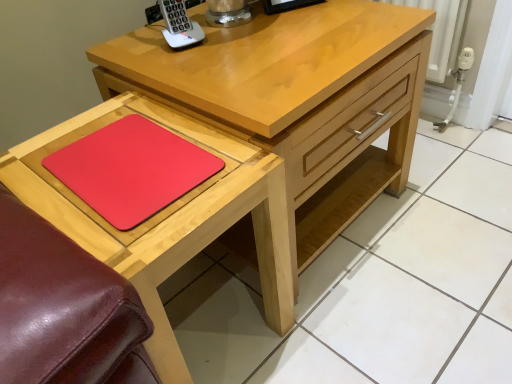
Question: Is matte wooden table at lower left outside of white plastic phone at upper center?

Choices:
 (A) yes
 (B) no

Answer: (A)

Question: Can you confirm if matte wooden table at lower left is positioned to the right of white plastic phone at upper center?

Choices:
 (A) yes
 (B) no

Answer: (B)

Question: Is matte wooden table at lower left not near white plastic phone at upper center?

Choices:
 (A) no
 (B) yes

Answer: (A)

Question: Does matte wooden table at lower left come in front of white plastic phone at upper center?

Choices:
 (A) yes
 (B) no

Answer: (A)

Question: Can you confirm if matte wooden table at lower left is thinner than white plastic phone at upper center?

Choices:
 (A) yes
 (B) no

Answer: (B)

Question: Is white plastic phone at upper center bigger or smaller than rubberized red mousepad at lower left?

Choices:
 (A) big
 (B) small

Answer: (B)

Question: From the image's perspective, relative to rubberized red mousepad at lower left, is white plastic phone at upper center above or below?

Choices:
 (A) above
 (B) below

Answer: (A)

Question: Which is correct: white plastic phone at upper center is inside rubberized red mousepad at lower left, or outside of it?

Choices:
 (A) inside
 (B) outside

Answer: (B)

Question: Is point (189, 44) closer or farther from the camera than point (119, 188)?

Choices:
 (A) farther
 (B) closer

Answer: (A)

Question: Is matte wooden table at lower left wider or thinner than matte wood chest of drawers at center?

Choices:
 (A) wide
 (B) thin

Answer: (B)

Question: Would you say matte wooden table at lower left is to the left or to the right of matte wood chest of drawers at center in the picture?

Choices:
 (A) left
 (B) right

Answer: (A)

Question: From their relative heights in the image, would you say matte wooden table at lower left is taller or shorter than matte wood chest of drawers at center?

Choices:
 (A) short
 (B) tall

Answer: (A)

Question: Is point (104, 122) closer or farther from the camera than point (286, 91)?

Choices:
 (A) closer
 (B) farther

Answer: (B)

Question: From a real-world perspective, is rubberized red mousepad at lower left positioned above or below matte wood chest of drawers at center?

Choices:
 (A) above
 (B) below

Answer: (A)

Question: In the image, is rubberized red mousepad at lower left positioned in front of or behind matte wood chest of drawers at center?

Choices:
 (A) front
 (B) behind

Answer: (A)